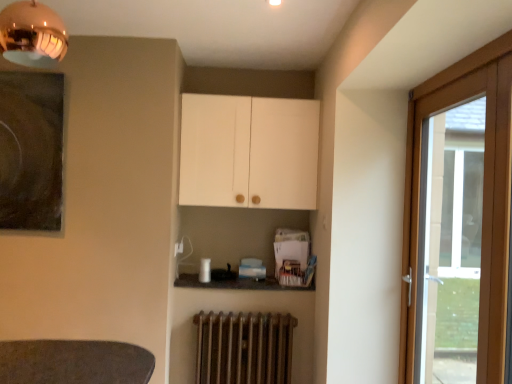
The width and height of the screenshot is (512, 384). What do you see at coordinates (244, 348) in the screenshot?
I see `rusty metal radiator at lower center` at bounding box center [244, 348].

What is the approximate height of granite countertop at center?

5.80 centimeters.

The image size is (512, 384). Find the location of `white matte cabinet at upper center`. white matte cabinet at upper center is located at coordinates (249, 152).

From the image's perspective, which is above, granite countertop at center or white matte cabinet at upper center?

white matte cabinet at upper center appears higher in the image.

Is granite countertop at center bigger than white matte cabinet at upper center?

No.

Measure the distance from granite countertop at center to white matte cabinet at upper center.

granite countertop at center and white matte cabinet at upper center are 30.88 inches apart from each other.

From their relative heights in the image, would you say granite countertop at center is taller or shorter than white matte cabinet at upper center?

In the image, granite countertop at center appears to be shorter than white matte cabinet at upper center.

Does white matte cabinet at upper center appear on the right side of wooden door at right?

Incorrect, white matte cabinet at upper center is not on the right side of wooden door at right.

In order to click on door located in front of the white matte cabinet at upper center in this screenshot , I will do `click(461, 229)`.

From a real-world perspective, is white matte cabinet at upper center located higher than wooden door at right?

Correct, in the physical world, white matte cabinet at upper center is higher than wooden door at right.

Would you say granite countertop at center is outside rusty metal radiator at lower center?

Yes, granite countertop at center is outside of rusty metal radiator at lower center.

From a real-world perspective, is granite countertop at center above or below rusty metal radiator at lower center?

granite countertop at center is above rusty metal radiator at lower center.

Is granite countertop at center oriented away from rusty metal radiator at lower center?

No.

Between granite countertop at center and rusty metal radiator at lower center, which one appears on the left side from the viewer's perspective?

From the viewer's perspective, granite countertop at center appears more on the left side.

Which of these two, rusty metal radiator at lower center or white matte cabinet at upper center, is bigger?

white matte cabinet at upper center.

Which of these two, rusty metal radiator at lower center or white matte cabinet at upper center, is thinner?

With smaller width is rusty metal radiator at lower center.

From a real-world perspective, is rusty metal radiator at lower center above or below white matte cabinet at upper center?

In terms of real-world spatial position, rusty metal radiator at lower center is below white matte cabinet at upper center.

Is wooden door at right positioned behind white matte cabinet at upper center?

No, wooden door at right is closer to the camera.

Considering the sizes of objects wooden door at right and white matte cabinet at upper center in the image provided, who is smaller, wooden door at right or white matte cabinet at upper center?

Smaller between the two is wooden door at right.

From a real-world perspective, who is located higher, wooden door at right or white matte cabinet at upper center?

white matte cabinet at upper center, from a real-world perspective.

Is wooden door at right next to white matte cabinet at upper center?

No.

Is rusty metal radiator at lower center located outside granite countertop at center?

Yes, rusty metal radiator at lower center is outside of granite countertop at center.

From the image's perspective, who appears lower, rusty metal radiator at lower center or granite countertop at center?

From the image's view, rusty metal radiator at lower center is below.

Can you confirm if rusty metal radiator at lower center is positioned to the right of granite countertop at center?

Yes, rusty metal radiator at lower center is to the right of granite countertop at center.

Consider the image. Are rusty metal radiator at lower center and granite countertop at center beside each other?

There is a gap between rusty metal radiator at lower center and granite countertop at center.

Consider the image. From the image's perspective, is rusty metal radiator at lower center on wooden door at right?

No.

What's the angular difference between rusty metal radiator at lower center and wooden door at right's facing directions?

The angular difference between rusty metal radiator at lower center and wooden door at right is 88.2 degrees.

Who is smaller, rusty metal radiator at lower center or wooden door at right?

With smaller size is rusty metal radiator at lower center.

Image resolution: width=512 pixels, height=384 pixels. Find the location of `cabinetry that appears in front of the granite countertop at center`. cabinetry that appears in front of the granite countertop at center is located at coordinates (249, 152).

In the image, there is a wooden door at right. Identify the location of cabinetry above it (from the image's perspective). (249, 152).

Which object lies nearer to the anchor point rusty metal radiator at lower center, white matte cabinet at upper center or granite countertop at center?

Among the two, granite countertop at center is located nearer to rusty metal radiator at lower center.

Estimate the real-world distances between objects in this image. Which object is closer to white matte cabinet at upper center, wooden door at right or rusty metal radiator at lower center?

wooden door at right.

Considering their positions, is granite countertop at center positioned closer to wooden door at right than white matte cabinet at upper center?

Among the two, white matte cabinet at upper center is located nearer to wooden door at right.

From the image, which object appears to be farther from wooden door at right, white matte cabinet at upper center or rusty metal radiator at lower center?

Among the two, rusty metal radiator at lower center is located further to wooden door at right.

When comparing their distances from white matte cabinet at upper center, does granite countertop at center or rusty metal radiator at lower center seem further?

rusty metal radiator at lower center.

Which object lies nearer to the anchor point wooden door at right, white matte cabinet at upper center or granite countertop at center?

The object closer to wooden door at right is white matte cabinet at upper center.

Estimate the real-world distances between objects in this image. Which object is further from rusty metal radiator at lower center, granite countertop at center or wooden door at right?

Among the two, wooden door at right is located further to rusty metal radiator at lower center.

Based on their spatial positions, is wooden door at right or granite countertop at center closer to white matte cabinet at upper center?

granite countertop at center lies closer to white matte cabinet at upper center than the other object.

Locate an element on the screen. radiator located between wooden door at right and white matte cabinet at upper center in the depth direction is located at coordinates (244, 348).

Where is `counter top between white matte cabinet at upper center and rusty metal radiator at lower center vertically`? counter top between white matte cabinet at upper center and rusty metal radiator at lower center vertically is located at coordinates (236, 283).

Identify the location of cabinetry located between wooden door at right and granite countertop at center in the depth direction. (249, 152).

This screenshot has width=512, height=384. In order to click on radiator positioned between wooden door at right and granite countertop at center from near to far in this screenshot , I will do `click(244, 348)`.